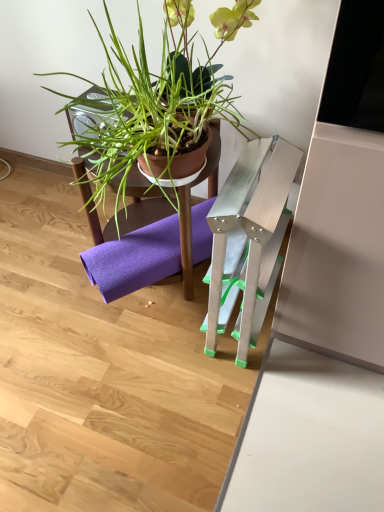
At what (x,y) coordinates should I click in order to perform the action: click on vacant space in front of brown matte plant pot at upper center. Please return your answer as a coordinate pair (x, y). Looking at the image, I should click on (143, 356).